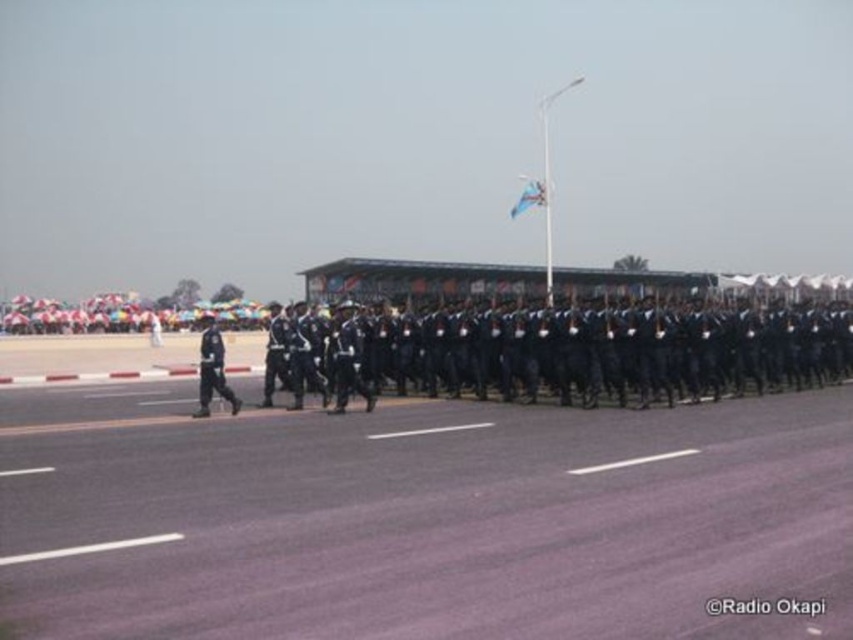
Looking at this image, you are a photographer positioned at the center of the scene. You need to capture a photo that includes both the black matte uniform at left and the group of soldiers marching in formation. Based on their positions, which direction should you move to frame both subjects in your camera view?

The black matte uniform at left is located at point [212,369], so you should move to the left to include both the black matte uniform at left and the group of soldiers marching in formation in your camera view.